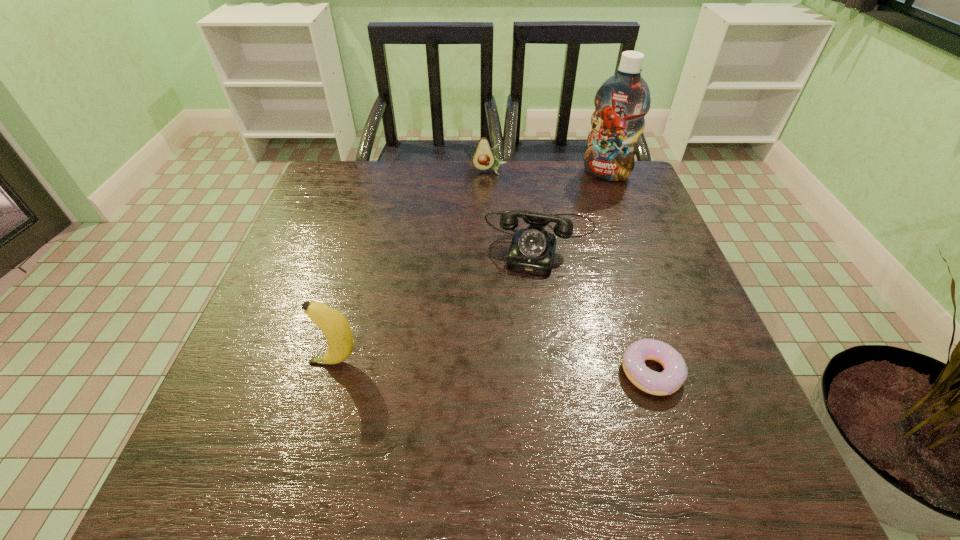
Identify the location of banana. This screenshot has height=540, width=960. (334, 325).

Locate an element on the screen. the fourth shortest object is located at coordinates (334, 325).

Locate an element on the screen. The height and width of the screenshot is (540, 960). the shortest object is located at coordinates (675, 372).

At what (x,y) coordinates should I click in order to perform the action: click on the third nearest object. Please return your answer as a coordinate pair (x, y). This screenshot has width=960, height=540. Looking at the image, I should click on pos(532,250).

Locate an element on the screen. Image resolution: width=960 pixels, height=540 pixels. shampoo is located at coordinates (622, 101).

Locate an element on the screen. The height and width of the screenshot is (540, 960). avocado is located at coordinates (484, 158).

You are a GUI agent. You are given a task and a screenshot of the screen. Output one action in this format:
    pyautogui.click(x=<x>, y=<y>)
    Task: Click on the free space located from the stem of the leftmost object
    This screenshot has width=960, height=540.
    Given the screenshot: What is the action you would take?
    pyautogui.click(x=236, y=362)

Find the location of a particular element. This screenshot has height=540, width=960. free location located from the stem of the leftmost object is located at coordinates (247, 362).

Where is `free space located on the back of the shortest object`? This screenshot has height=540, width=960. free space located on the back of the shortest object is located at coordinates (626, 291).

Image resolution: width=960 pixels, height=540 pixels. I want to click on vacant region located 0.060m on the front-facing side of the third nearest object, so click(529, 294).